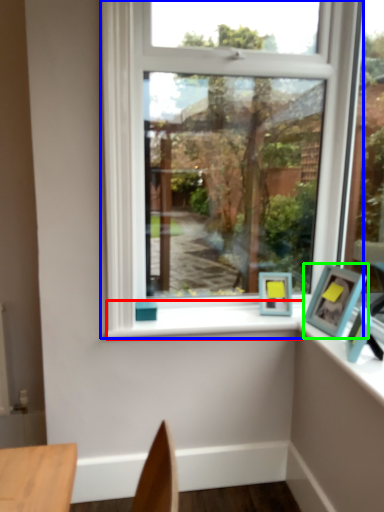
Question: Which is farther away from window sill (highlighted by a red box)? window (highlighted by a blue box) or picture frame (highlighted by a green box)?

Choices:
 (A) window
 (B) picture frame

Answer: (B)